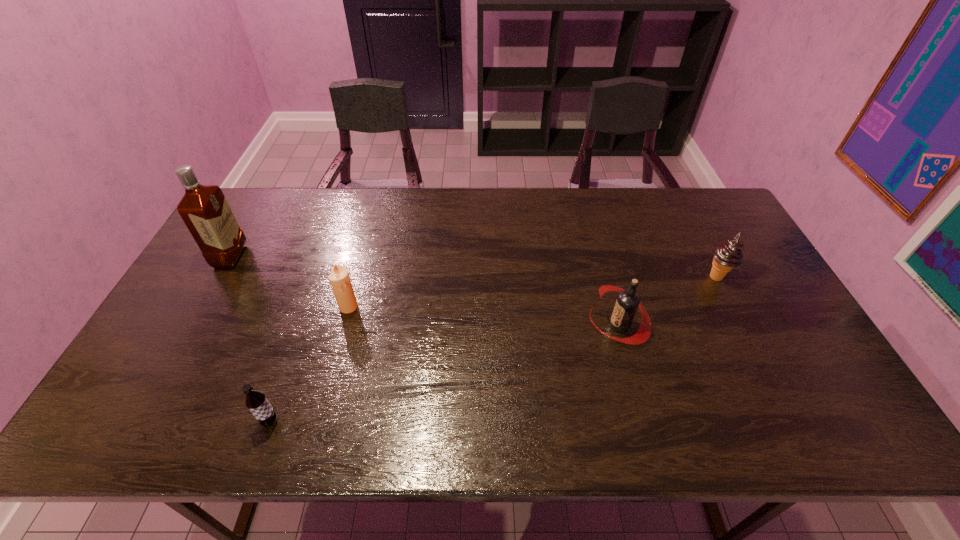
Where is `vacant space at the left edge of the desktop`? vacant space at the left edge of the desktop is located at coordinates (210, 291).

Locate an element on the screen. The height and width of the screenshot is (540, 960). vacant space at the far left corner of the desktop is located at coordinates (258, 230).

In the image, there is a desktop. Where is `vacant space at the far right corner`? The image size is (960, 540). vacant space at the far right corner is located at coordinates (692, 194).

Image resolution: width=960 pixels, height=540 pixels. I want to click on unoccupied area between the third object from right to left and the rightmost object, so click(x=533, y=292).

The height and width of the screenshot is (540, 960). Identify the location of free space between the leftmost object and the second object from right to left. (424, 291).

Identify the location of free space that is in between the liquor and the third object from right to left. (x=290, y=282).

The image size is (960, 540). In order to click on empty space that is in between the second object from right to left and the second object from left to right in this screenshot , I will do `click(444, 373)`.

At what (x,y) coordinates should I click in order to perform the action: click on blank region between the icecream and the candle. Please return your answer as a coordinate pair (x, y). Looking at the image, I should click on (533, 292).

What are the coordinates of `free space between the candle and the rightmost object` in the screenshot? It's located at (533, 292).

In order to click on empty space between the fourth object from right to left and the liquor in this screenshot , I will do `click(251, 339)`.